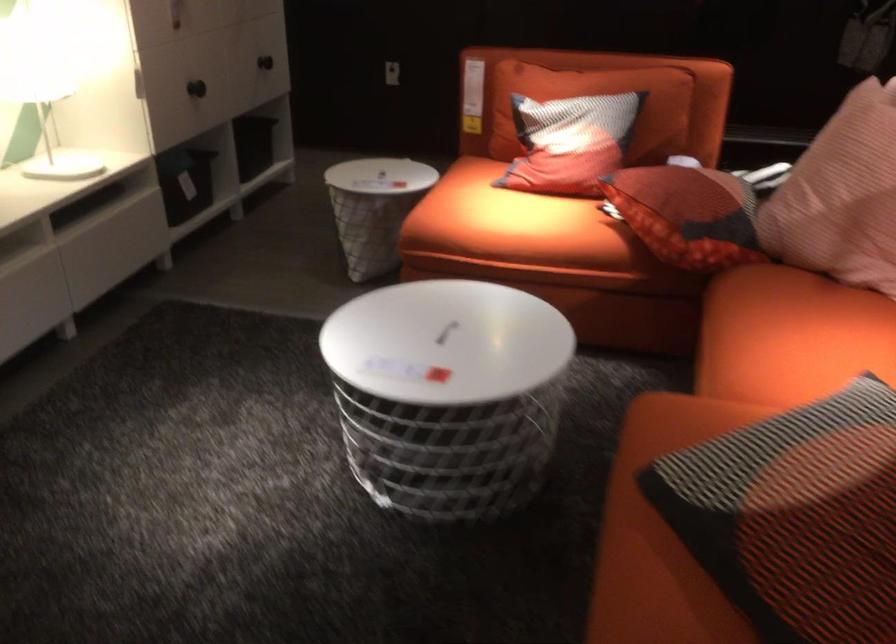
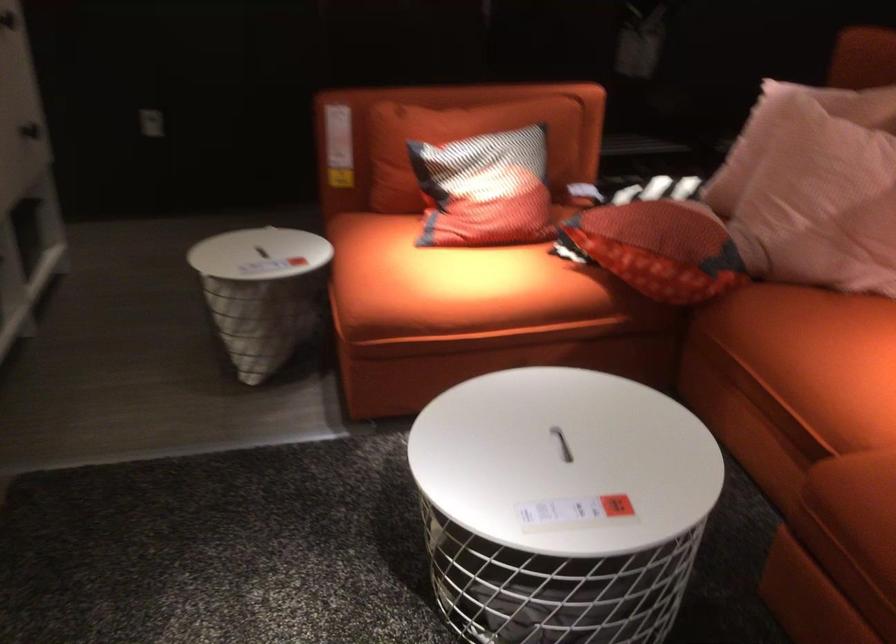
Question: The camera is either moving clockwise (left) or counter-clockwise (right) around the object. The first image is from the beginning of the video and the second image is from the end. Is the camera moving left or right when shooting the video?

Choices:
 (A) Left
 (B) Right

Answer: (A)